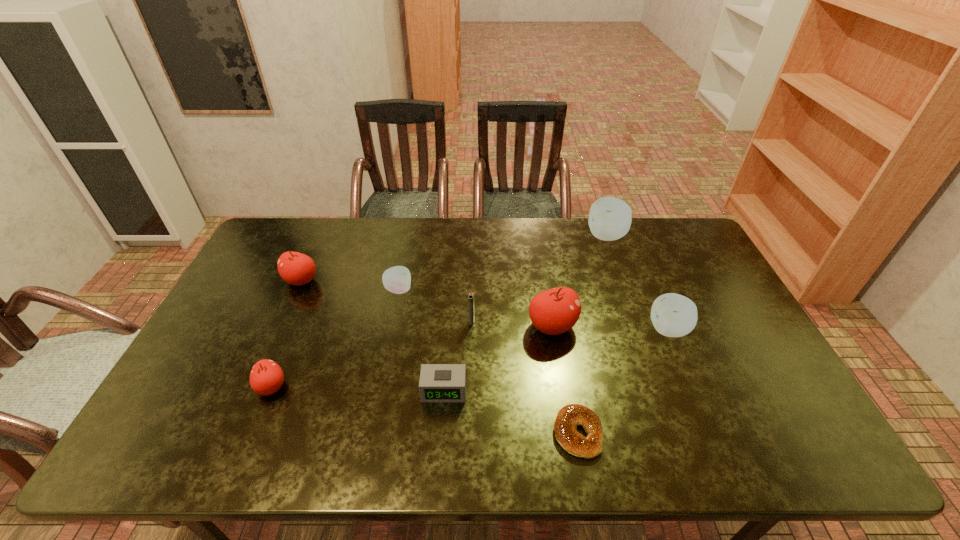
Locate an element on the screen. Image resolution: width=960 pixels, height=540 pixels. vacant space that satisfies the following two spatial constraints: 1. on the front-facing side of the second shortest object; 2. on the left side of the bagel is located at coordinates (442, 433).